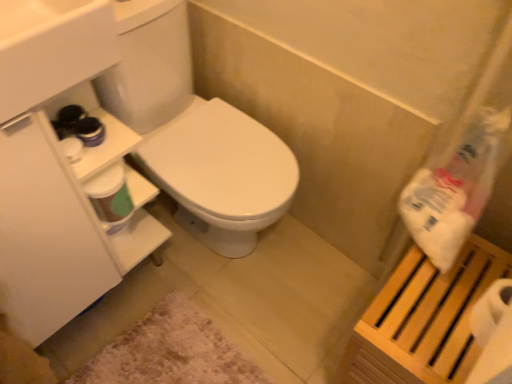
The image size is (512, 384). Identify the location of free space behind white matte toilet paper at right. [465, 269].